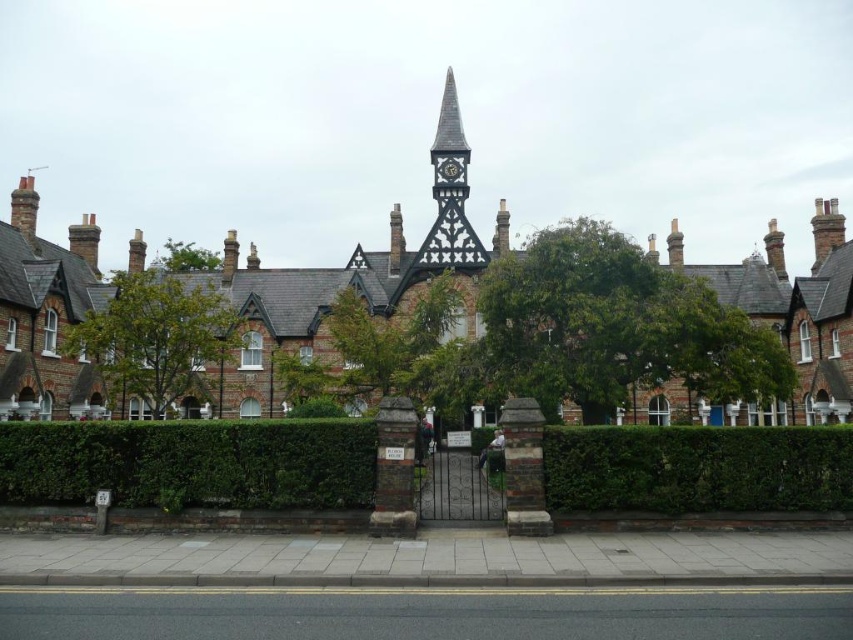
Question: Is green leafy tree at upper center above metallic clock at upper center?

Choices:
 (A) no
 (B) yes

Answer: (A)

Question: Does green leafy hedge at center come behind green leafy tree at left?

Choices:
 (A) yes
 (B) no

Answer: (B)

Question: Which object is closer to the camera taking this photo?

Choices:
 (A) green leafy hedge at center
 (B) green leafy tree at left

Answer: (A)

Question: Which object is the closest to the green leafy tree at center?

Choices:
 (A) green leafy tree at left
 (B) green leafy tree at upper center
 (C) green leafy hedge at lower center
 (D) metallic clock at upper center

Answer: (A)

Question: In this image, where is green leafy hedge at lower center located relative to green leafy hedge at center?

Choices:
 (A) above
 (B) below

Answer: (A)

Question: Which point appears closest to the camera in this image?

Choices:
 (A) (99, 433)
 (B) (190, 252)
 (C) (329, 310)

Answer: (A)